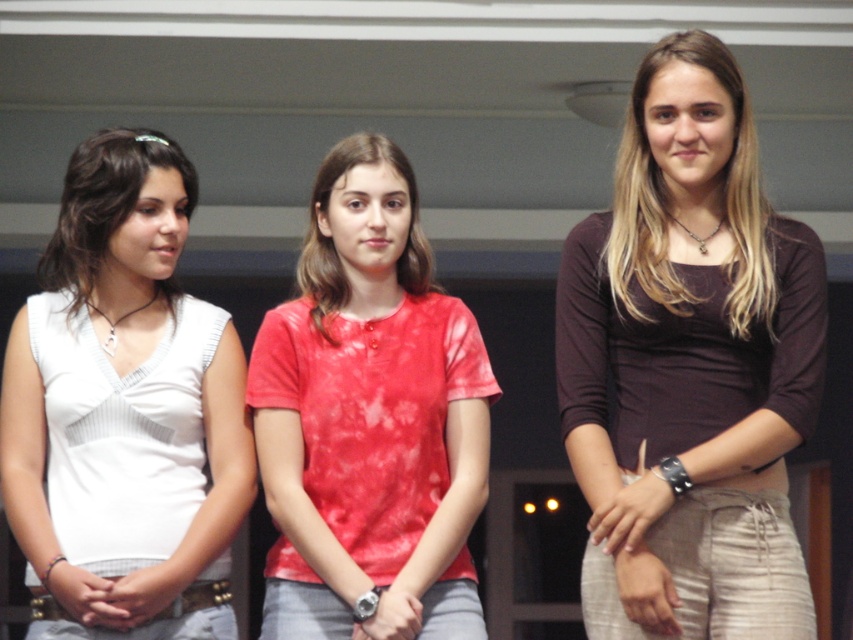
You are standing at the point marked by the coordinates point (602, 394). You want to throw a ball to a friend who is standing 4 meters away from you. Is your friend within reach?

The distance between point (602, 394) and the viewer is 3.86 meters, so yes, the friend is within reach since 3.86 meters is less than 4 meters.